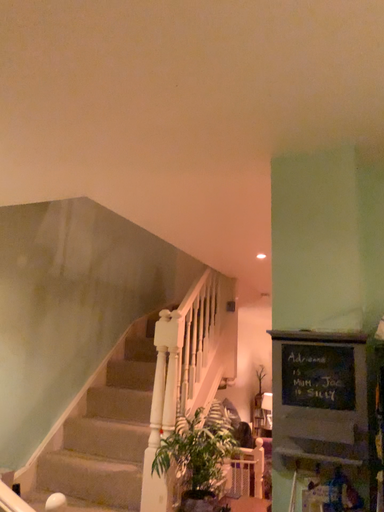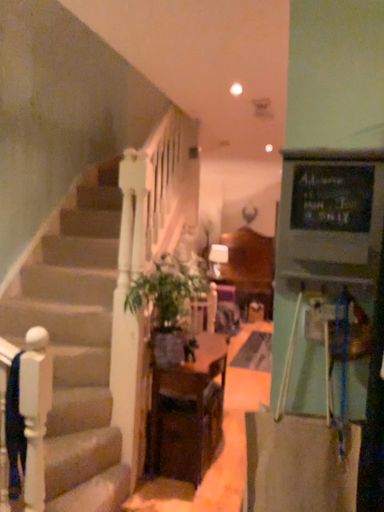
Question: How did the camera likely rotate when shooting the video?

Choices:
 (A) rotated right
 (B) rotated left

Answer: (A)